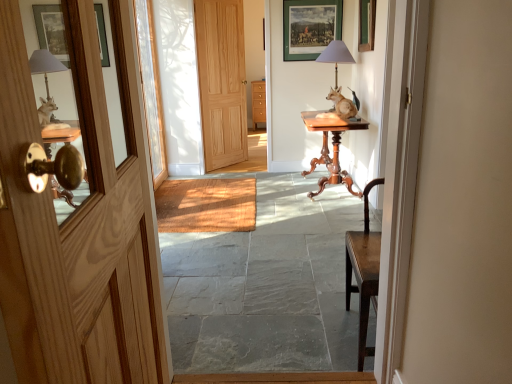
Locate an element on the screen. free space above smooth stone floor at center (from a real-world perspective) is located at coordinates (234, 212).